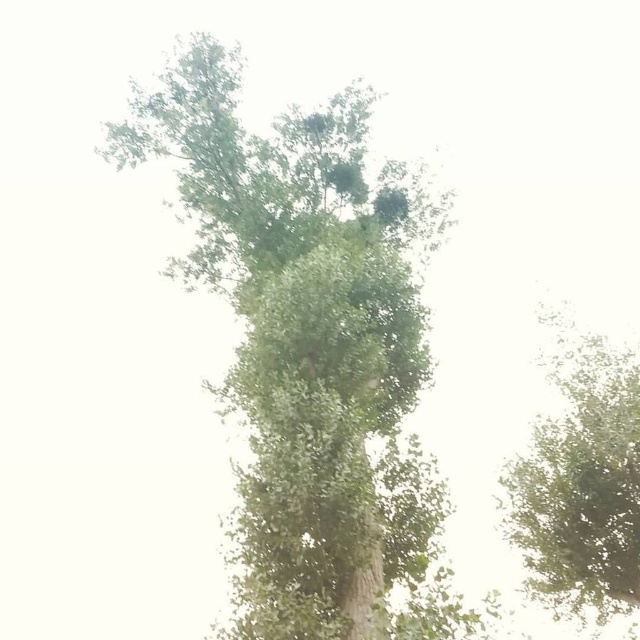
You are a bird looking for a nesting spot. You see the green leafy tree at center and the green leafy tree at upper center. Which tree is taller and would provide a better vantage point?

The green leafy tree at upper center is taller than the green leafy tree at center, so it would provide a better vantage point.

Looking at this image, you are standing 30 feet away from the green leafy tree at center. Can you safely walk towards it without tripping over any obstacles?

The distance between you and the green leafy tree at center is 30.01 feet. Since there are no obstacles mentioned in the scene description, you can safely walk towards it.